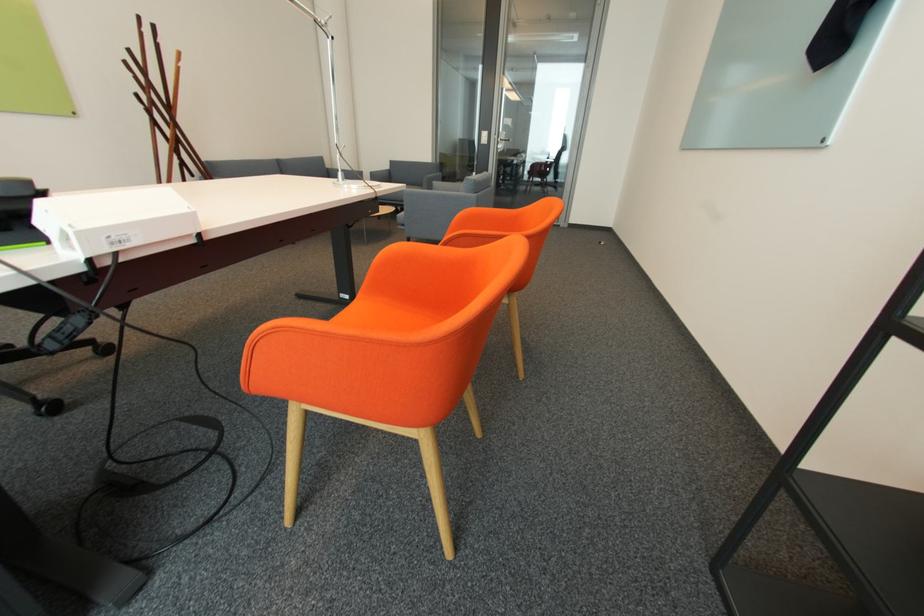
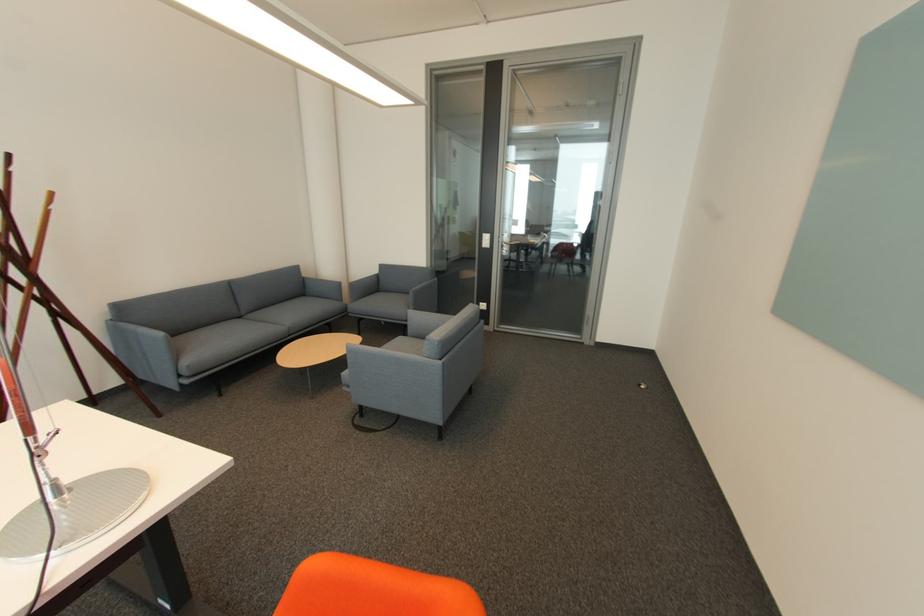
Where in the second image is the point corresponding to (333,169) from the first image?

(310, 278)